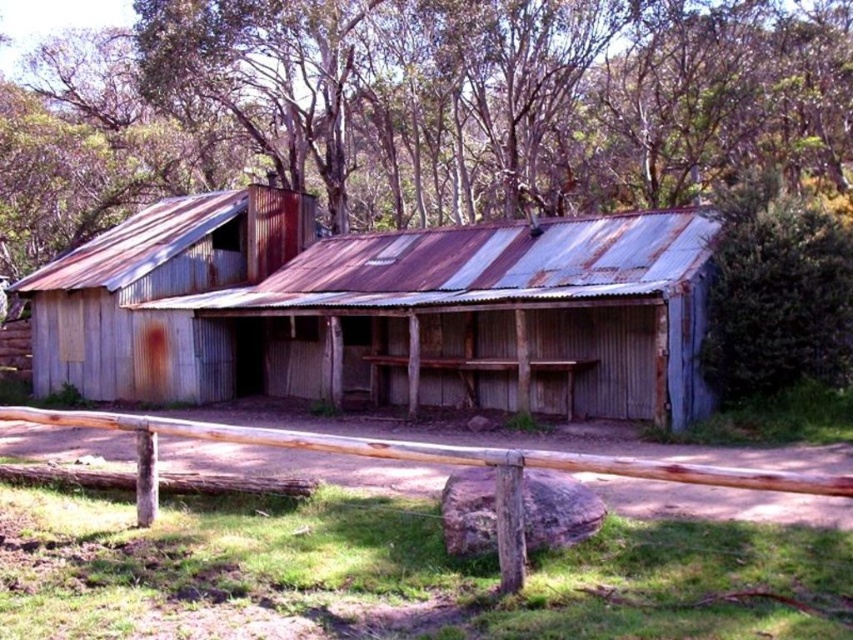
Is point (511, 369) closer to camera compared to point (761, 333)?

No.

Between rusty corrugated metal barn at center and green leafy bush at upper right, which one appears on the right side from the viewer's perspective?

Positioned to the right is green leafy bush at upper right.

Is point (239, 218) closer to viewer compared to point (723, 221)?

No, it is not.

In order to click on rusty corrugated metal barn at center in this screenshot , I will do `click(380, 310)`.

Is rusty corrugated metal barn at center behind rusty corrugated metal hut at center?

No.

What do you see at coordinates (380, 310) in the screenshot? The width and height of the screenshot is (853, 640). I see `rusty corrugated metal barn at center` at bounding box center [380, 310].

What are the coordinates of `rusty corrugated metal barn at center` in the screenshot? It's located at (380, 310).

Is point (219, 372) in front of point (749, 220)?

No, it is not.

Describe the element at coordinates (155, 291) in the screenshot. This screenshot has width=853, height=640. I see `rusty corrugated metal hut at center` at that location.

This screenshot has width=853, height=640. What are the coordinates of `rusty corrugated metal hut at center` in the screenshot? It's located at (155, 291).